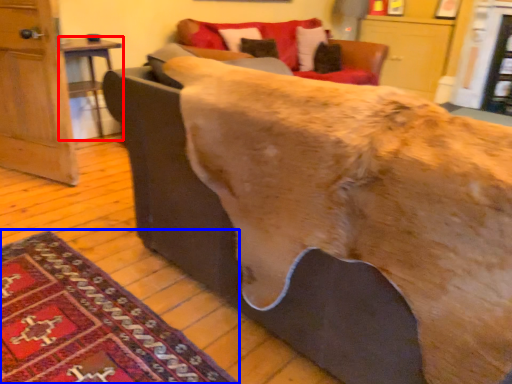
Question: Which of the following is the closest to the observer, table (highlighted by a red box) or mat (highlighted by a blue box)?

Choices:
 (A) table
 (B) mat

Answer: (B)